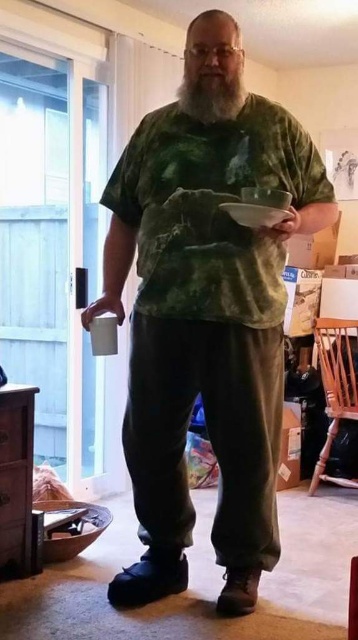
Looking at this image, you are a guest in this home and want to place your drink on the nearest available surface. You have a matte white cup at lower left and a matte green plate at upper center in your view. Which one is closer to you?

The matte green plate at upper center is in front of the matte white cup at lower left, so it is closer to you.